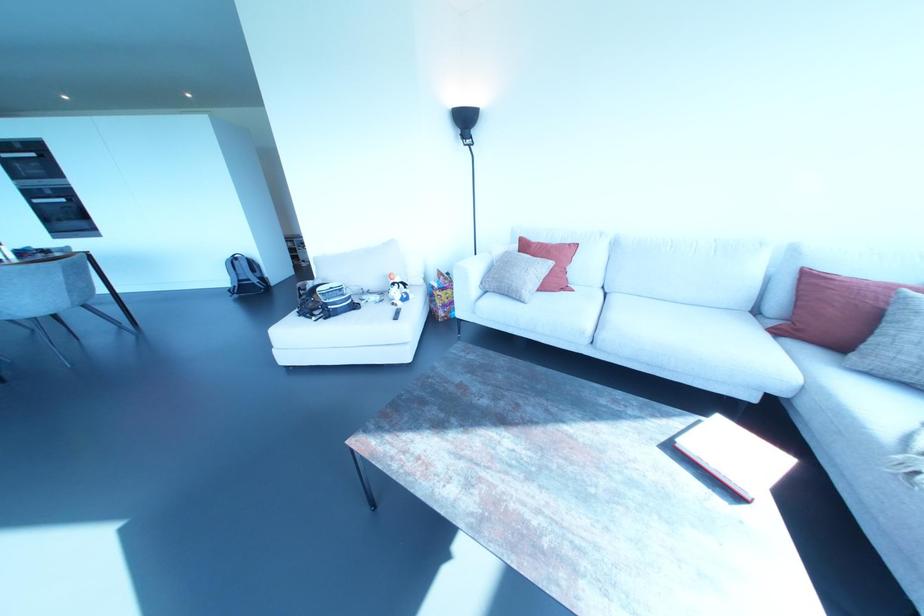
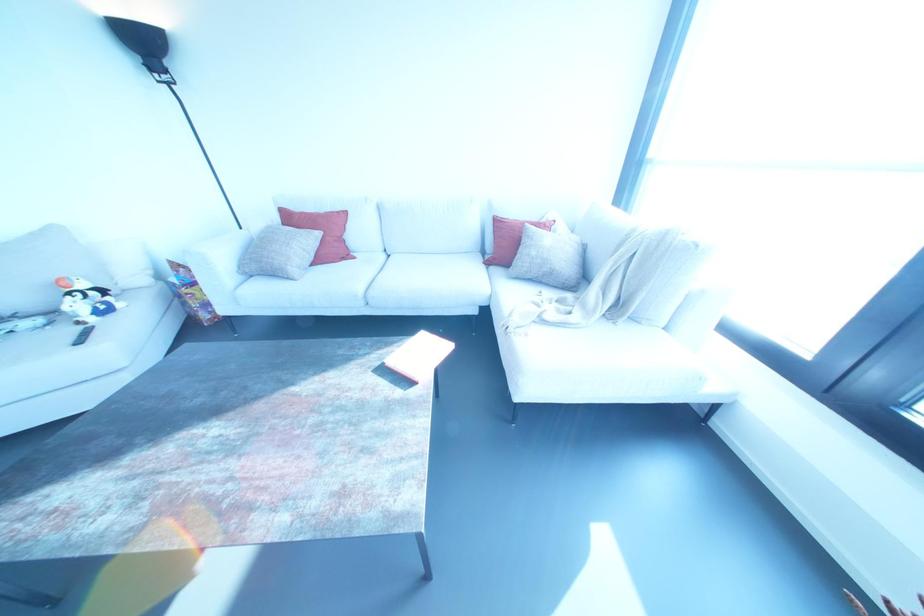
In the second image, find the point that corresponds to (x=518, y=300) in the first image.

(287, 277)